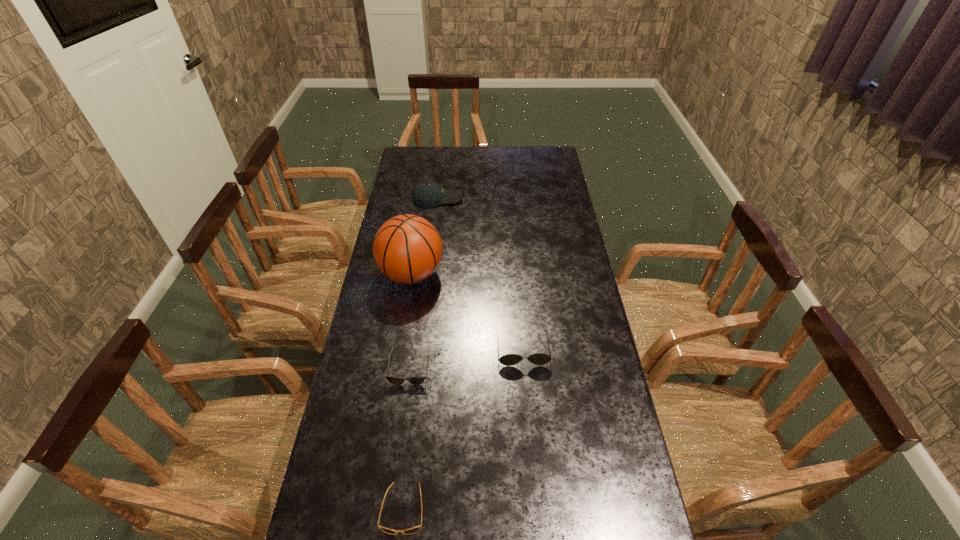
Select which sunglasses appears as the closest to the nearest sunglasses. Please provide its 2D coordinates. Your answer should be formatted as a tuple, i.e. [(x, y)], where the tuple contains the x and y coordinates of a point satisfying the conditions above.

[(394, 380)]

What are the coordinates of `the third closest sunglasses to the tallest object` in the screenshot? It's located at (413, 530).